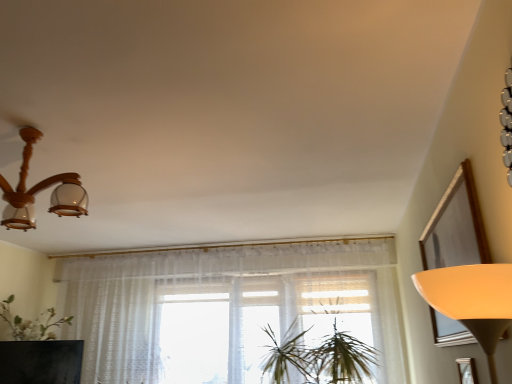
Question: Considering the relative sizes of green leafy plant at center and wooden chandelier at upper left in the image provided, is green leafy plant at center bigger than wooden chandelier at upper left?

Choices:
 (A) no
 (B) yes

Answer: (B)

Question: Is green leafy plant at center to the right of wooden chandelier at upper left from the viewer's perspective?

Choices:
 (A) yes
 (B) no

Answer: (A)

Question: Is green leafy plant at center beside wooden chandelier at upper left?

Choices:
 (A) yes
 (B) no

Answer: (B)

Question: From a real-world perspective, is green leafy plant at center located beneath wooden chandelier at upper left?

Choices:
 (A) yes
 (B) no

Answer: (A)

Question: Is green leafy plant at center oriented towards wooden chandelier at upper left?

Choices:
 (A) yes
 (B) no

Answer: (B)

Question: Can you confirm if green leafy plant at center is positioned to the left of wooden chandelier at upper left?

Choices:
 (A) no
 (B) yes

Answer: (A)

Question: Can you confirm if matte black tv at lower left is shorter than wooden picture frame at lower right?

Choices:
 (A) no
 (B) yes

Answer: (A)

Question: Can you confirm if matte black tv at lower left is thinner than wooden picture frame at lower right?

Choices:
 (A) no
 (B) yes

Answer: (A)

Question: Could you tell me if matte black tv at lower left is turned towards wooden picture frame at lower right?

Choices:
 (A) no
 (B) yes

Answer: (B)

Question: Does matte black tv at lower left appear on the right side of wooden picture frame at lower right?

Choices:
 (A) no
 (B) yes

Answer: (A)

Question: Is matte black tv at lower left next to wooden picture frame at lower right?

Choices:
 (A) yes
 (B) no

Answer: (B)

Question: From the image's perspective, would you say matte black tv at lower left is shown under wooden picture frame at lower right?

Choices:
 (A) no
 (B) yes

Answer: (B)

Question: Is green leafy plant at center oriented away from sheer white curtain at center?

Choices:
 (A) no
 (B) yes

Answer: (A)